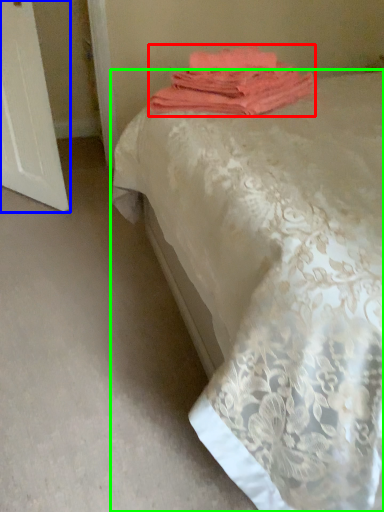
Question: Which is farther away from towel (highlighted by a red box)? screen door (highlighted by a blue box) or bed (highlighted by a green box)?

Choices:
 (A) screen door
 (B) bed

Answer: (A)